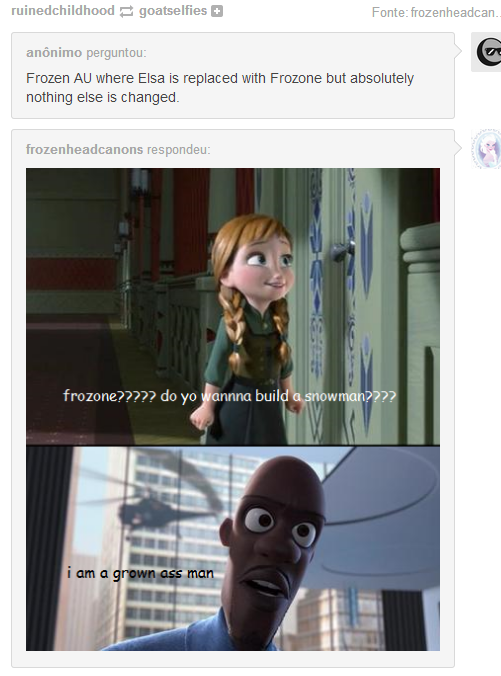
Find the location of a particular element. wall decor is located at coordinates (365, 378).